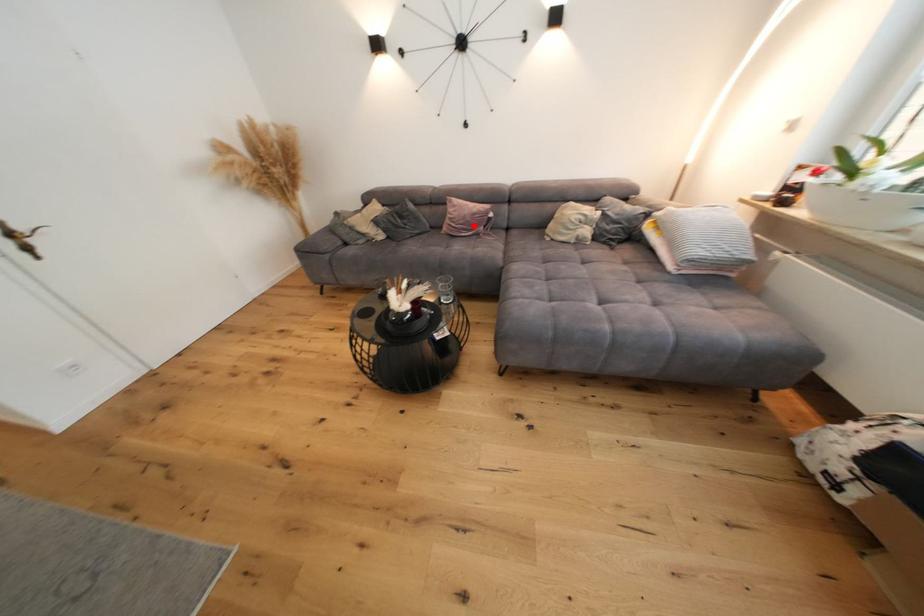
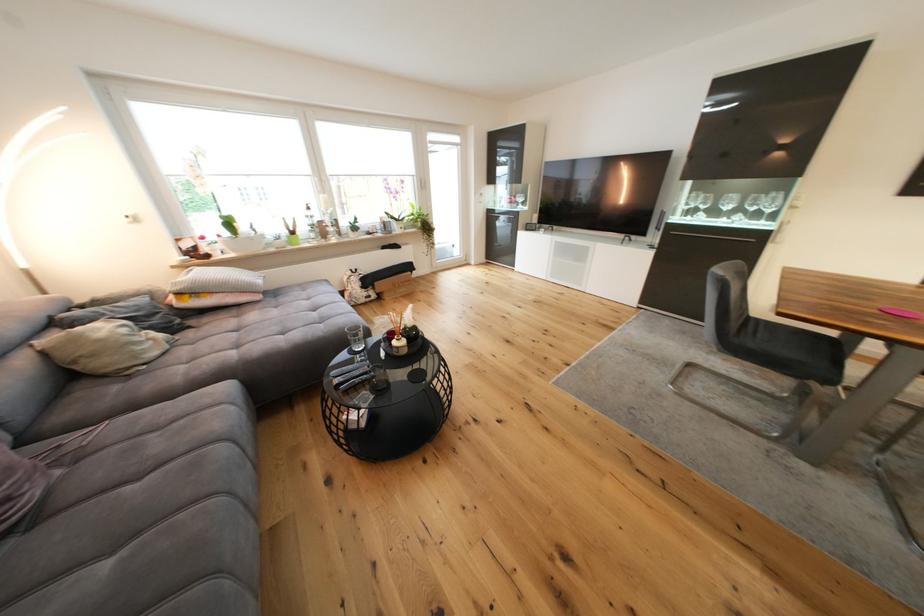
Locate, in the second image, the point that corresponds to the highlighted location in the first image.

(18, 469)